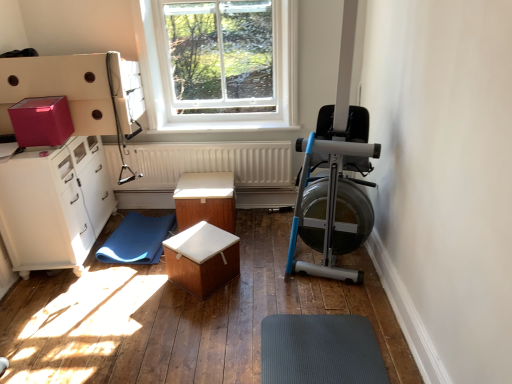
Identify the location of vacant area to the right of wooden box at center, arranged as the second table when viewed from the back. The height and width of the screenshot is (384, 512). (255, 282).